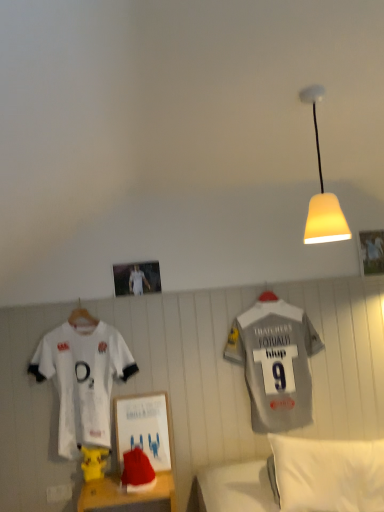
Question: Can you confirm if metallic silver photo frame at upper center, acting as the second picture frame starting from the back, is positioned to the right of white jersey at left, which ranks as the second sports uniform in right-to-left order?

Choices:
 (A) yes
 (B) no

Answer: (A)

Question: Are metallic silver photo frame at upper center, acting as the second picture frame starting from the back, and white jersey at left, arranged as the 1th sports uniform when viewed from the left, beside each other?

Choices:
 (A) no
 (B) yes

Answer: (A)

Question: Is white jersey at left, arranged as the 1th sports uniform when viewed from the left, at the back of metallic silver photo frame at upper center, which ranks as the first picture frame in front-to-back order?

Choices:
 (A) no
 (B) yes

Answer: (A)

Question: Is metallic silver photo frame at upper center, the first picture frame from the left, positioned before white jersey at left, which ranks as the second sports uniform in right-to-left order?

Choices:
 (A) no
 (B) yes

Answer: (A)

Question: From the image's perspective, is metallic silver photo frame at upper center, which ranks as the first picture frame in front-to-back order, beneath white jersey at left, which ranks as the second sports uniform in right-to-left order?

Choices:
 (A) yes
 (B) no

Answer: (B)

Question: From the image's perspective, would you say metallic silver photo frame at upper center, which ranks as the first picture frame in front-to-back order, is positioned over white jersey at left, arranged as the 1th sports uniform when viewed from the left?

Choices:
 (A) no
 (B) yes

Answer: (B)

Question: Considering the relative sizes of yellow matte lampshade at upper right and wooden picture frame at upper right, placed as the 2th picture frame when sorted from left to right, in the image provided, is yellow matte lampshade at upper right taller than wooden picture frame at upper right, placed as the 2th picture frame when sorted from left to right,?

Choices:
 (A) no
 (B) yes

Answer: (B)

Question: Does yellow matte lampshade at upper right turn towards wooden picture frame at upper right, the first picture frame viewed from the right?

Choices:
 (A) yes
 (B) no

Answer: (B)

Question: Considering the relative positions of yellow matte lampshade at upper right and wooden picture frame at upper right, the first picture frame viewed from the right, in the image provided, is yellow matte lampshade at upper right to the right of wooden picture frame at upper right, the first picture frame viewed from the right, from the viewer's perspective?

Choices:
 (A) no
 (B) yes

Answer: (A)

Question: Can you confirm if yellow matte lampshade at upper right is positioned to the left of wooden picture frame at upper right, the first picture frame viewed from the right?

Choices:
 (A) yes
 (B) no

Answer: (A)

Question: Does yellow matte lampshade at upper right touch wooden picture frame at upper right, marked as the second picture frame in a front-to-back arrangement?

Choices:
 (A) yes
 (B) no

Answer: (B)

Question: Considering the relative sizes of yellow matte lampshade at upper right and wooden picture frame at upper right, placed as the 2th picture frame when sorted from left to right, in the image provided, is yellow matte lampshade at upper right wider than wooden picture frame at upper right, placed as the 2th picture frame when sorted from left to right,?

Choices:
 (A) no
 (B) yes

Answer: (B)

Question: Is yellow matte lampshade at upper right far away from metallic silver photo frame at upper center, which ranks as the first picture frame in front-to-back order?

Choices:
 (A) no
 (B) yes

Answer: (B)